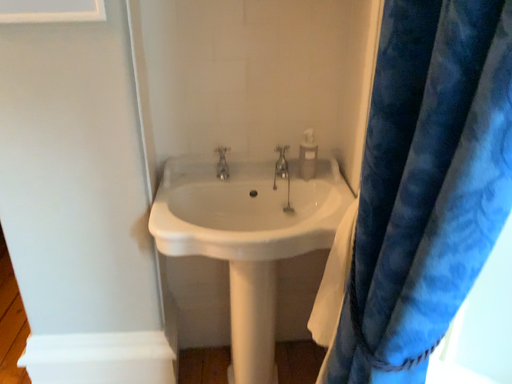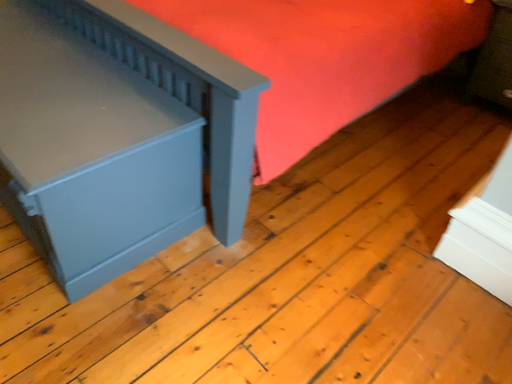
Question: How did the camera likely rotate when shooting the video?

Choices:
 (A) rotated right
 (B) rotated left

Answer: (B)